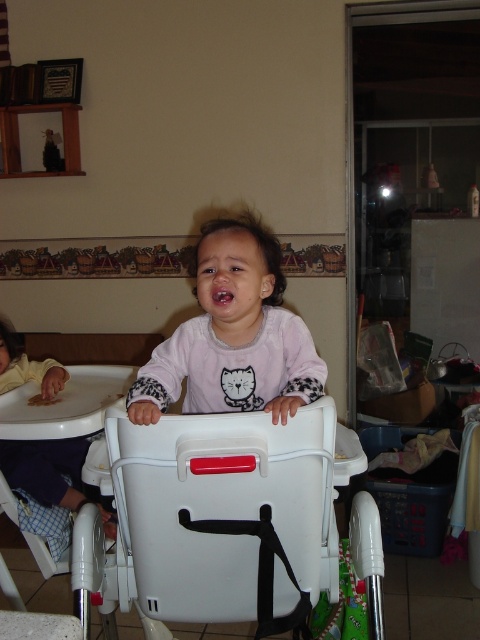
Question: Can you confirm if pink matte shirt at center is smaller than purple soft baby at left?

Choices:
 (A) no
 (B) yes

Answer: (B)

Question: Is pink matte shirt at center below purple soft baby at left?

Choices:
 (A) no
 (B) yes

Answer: (A)

Question: Can you confirm if pink matte shirt at center is thinner than purple soft baby at left?

Choices:
 (A) no
 (B) yes

Answer: (B)

Question: Which of the following is the closest to the observer?

Choices:
 (A) (276, 332)
 (B) (0, 456)

Answer: (A)

Question: Which point is closer to the camera taking this photo?

Choices:
 (A) click(108, 616)
 (B) click(24, 472)

Answer: (B)

Question: Which object is positioned closest to the pink matte shirt at center?

Choices:
 (A) white plastic baby carriage at center
 (B) purple soft baby at left

Answer: (A)